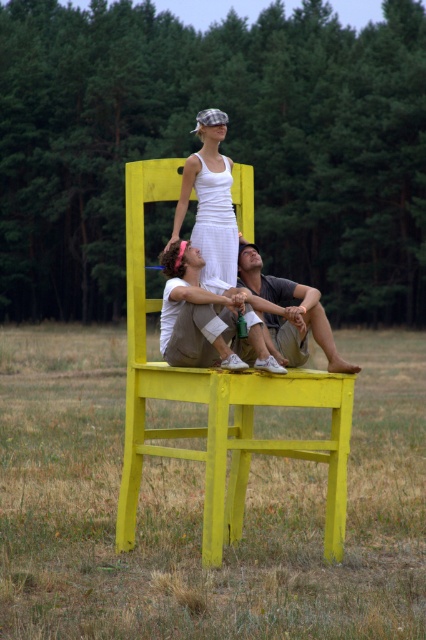
Question: Can you confirm if yellow wood chair at center is smaller than yellow painted wood chair at center?

Choices:
 (A) yes
 (B) no

Answer: (B)

Question: Which of the following is the farthest from the observer?

Choices:
 (A) matte white dress at center
 (B) matte gray shirt at lower center
 (C) white cotton dress at center
 (D) yellow painted wood chair at center

Answer: (C)

Question: Can you confirm if yellow wood chair at center is positioned to the right of white striped tank top at center?

Choices:
 (A) yes
 (B) no

Answer: (B)

Question: Considering the real-world distances, which object is farthest from the yellow painted wood chair at center?

Choices:
 (A) matte gray shirt at lower center
 (B) white striped tank top at center
 (C) white cotton dress at center
 (D) matte white dress at center

Answer: (B)

Question: Which point is closer to the camera?

Choices:
 (A) (313, 316)
 (B) (109, 461)
 (C) (218, 218)

Answer: (A)

Question: Is yellow painted wood chair at center positioned in front of matte white dress at center?

Choices:
 (A) yes
 (B) no

Answer: (A)